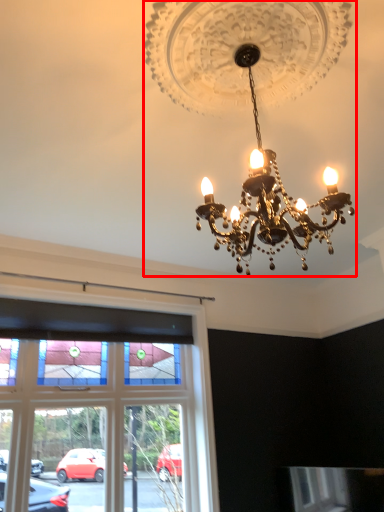
Question: Observing the image, what is the correct spatial positioning of lamp (annotated by the red box) in reference to window?

Choices:
 (A) right
 (B) left

Answer: (A)